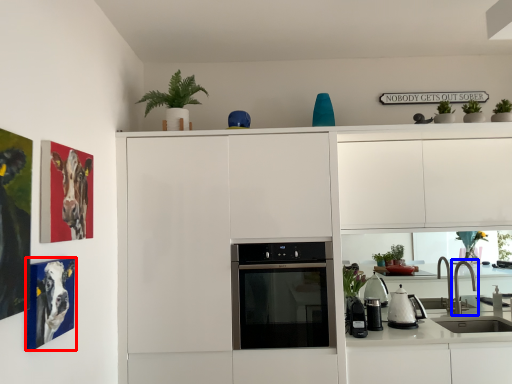
Question: Among these objects, which one is nearest to the camera, picture frame (highlighted by a red box) or tap (highlighted by a blue box)?

Choices:
 (A) picture frame
 (B) tap

Answer: (A)